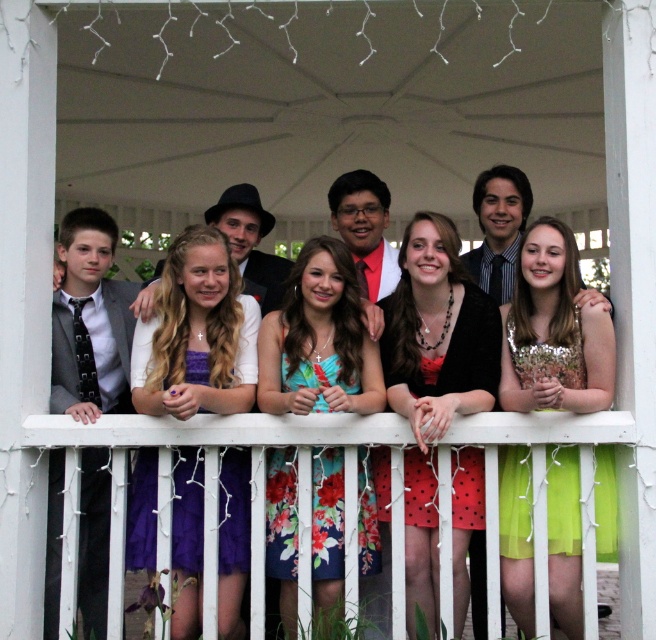
Which is more to the left, purple satin dress at center or floral dress at center?

From the viewer's perspective, purple satin dress at center appears more on the left side.

Does purple satin dress at center come in front of floral dress at center?

Yes, purple satin dress at center is closer to the viewer.

Between point (201, 276) and point (287, 502), which one is positioned behind?

Point (201, 276)

Find the location of a particular element. purple satin dress at center is located at coordinates [x=195, y=333].

Does purple satin dress at center come behind green sequined dress at center?

That is True.

Is purple satin dress at center to the right of green sequined dress at center from the viewer's perspective?

In fact, purple satin dress at center is to the left of green sequined dress at center.

Between point (136, 401) and point (567, 566), which one is positioned behind?

Point (136, 401)

Find the location of `purple satin dress at center`. purple satin dress at center is located at coordinates (195, 333).

Image resolution: width=656 pixels, height=640 pixels. Find the location of `polka dot fabric dress at center`. polka dot fabric dress at center is located at coordinates (434, 378).

Who is more forward, (379, 508) or (550, 564)?

Positioned in front is point (550, 564).

Where is `polka dot fabric dress at center`? The height and width of the screenshot is (640, 656). polka dot fabric dress at center is located at coordinates (434, 378).